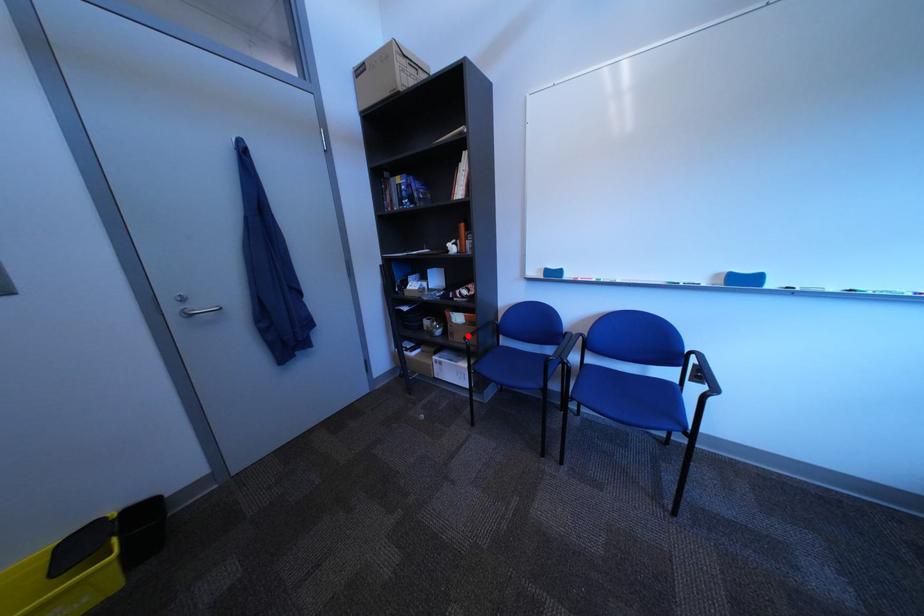
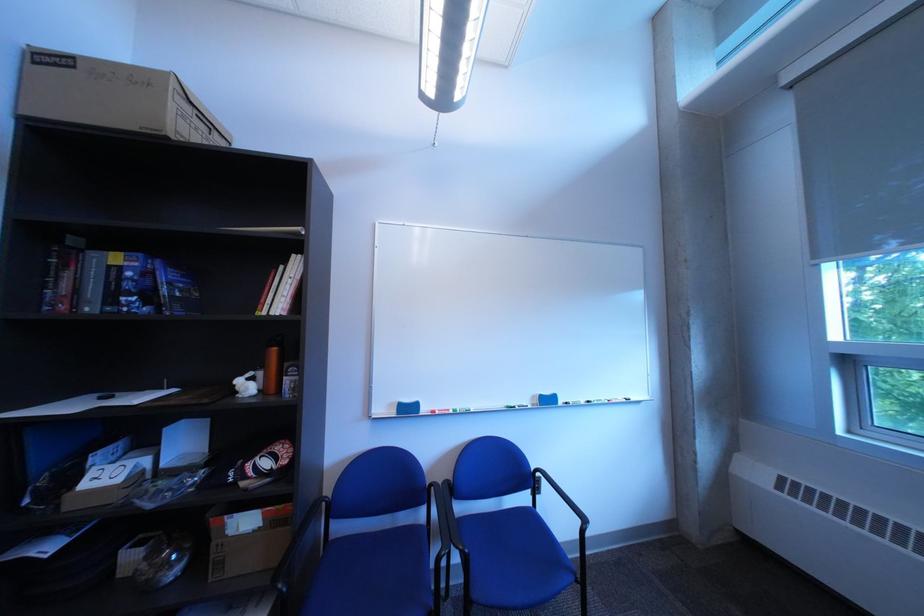
Question: I am providing you with two images of the same scene from different viewpoints. A red point is shown in image1. For the corresponding object point in image2, is it positioned nearer or farther from the camera?

Choices:
 (A) Nearer
 (B) Farther

Answer: (A)